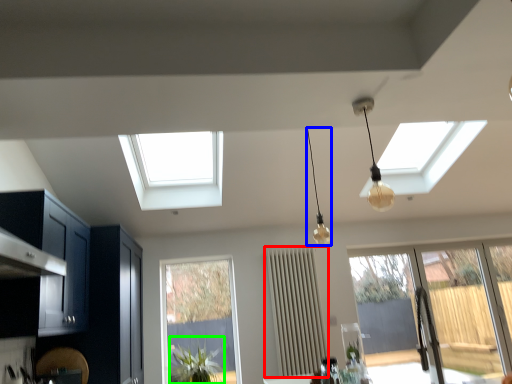
Question: Which object is positioned farthest from curtain (highlighted by a red box)? Select from lamp (highlighted by a blue box) and plant (highlighted by a green box).

Choices:
 (A) lamp
 (B) plant

Answer: (B)